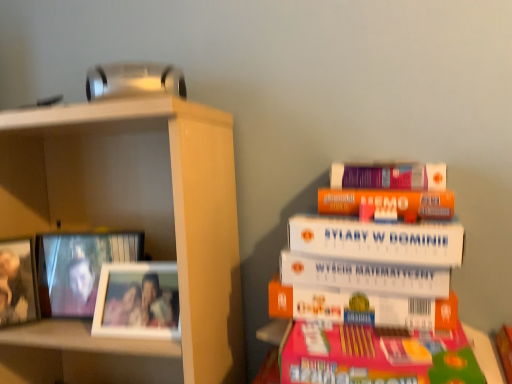
Question: Is white matte book at upper right looking in the opposite direction of wooden photo frame at left, which is counted as the second picture frame, starting from the left?

Choices:
 (A) no
 (B) yes

Answer: (A)

Question: Is white matte book at upper right smaller than wooden photo frame at left, which is counted as the second picture frame, starting from the left?

Choices:
 (A) yes
 (B) no

Answer: (B)

Question: Does white matte book at upper right turn towards wooden photo frame at left, which is counted as the second picture frame, starting from the left?

Choices:
 (A) yes
 (B) no

Answer: (B)

Question: Can you confirm if white matte book at upper right is bigger than wooden photo frame at left, the second picture frame from the right?

Choices:
 (A) no
 (B) yes

Answer: (B)

Question: Can you confirm if white matte book at upper right is thinner than wooden photo frame at left, the second picture frame from the right?

Choices:
 (A) yes
 (B) no

Answer: (B)

Question: Is white matte book at upper right with wooden photo frame at left, the second picture frame from the right?

Choices:
 (A) yes
 (B) no

Answer: (B)

Question: Does white matte book at upper right contain metallic silver picture frame at left, positioned as the 1th picture frame in left-to-right order?

Choices:
 (A) yes
 (B) no

Answer: (B)

Question: Considering the relative sizes of white matte book at upper right and metallic silver picture frame at left, positioned as the 1th picture frame in left-to-right order, in the image provided, is white matte book at upper right smaller than metallic silver picture frame at left, positioned as the 1th picture frame in left-to-right order,?

Choices:
 (A) yes
 (B) no

Answer: (B)

Question: Does white matte book at upper right have a larger size compared to metallic silver picture frame at left, acting as the 3th picture frame starting from the right?

Choices:
 (A) yes
 (B) no

Answer: (A)

Question: Considering the relative sizes of white matte book at upper right and metallic silver picture frame at left, positioned as the 1th picture frame in left-to-right order, in the image provided, is white matte book at upper right wider than metallic silver picture frame at left, positioned as the 1th picture frame in left-to-right order,?

Choices:
 (A) no
 (B) yes

Answer: (B)

Question: Could you tell me if white matte book at upper right is facing metallic silver picture frame at left, positioned as the 1th picture frame in left-to-right order?

Choices:
 (A) yes
 (B) no

Answer: (B)

Question: Are white matte book at upper right and metallic silver picture frame at left, positioned as the 1th picture frame in left-to-right order, making contact?

Choices:
 (A) no
 (B) yes

Answer: (A)

Question: Considering the relative positions of metallic silver picture frame at left, positioned as the 1th picture frame in left-to-right order, and white matte book at upper right in the image provided, is metallic silver picture frame at left, positioned as the 1th picture frame in left-to-right order, to the right of white matte book at upper right from the viewer's perspective?

Choices:
 (A) yes
 (B) no

Answer: (B)